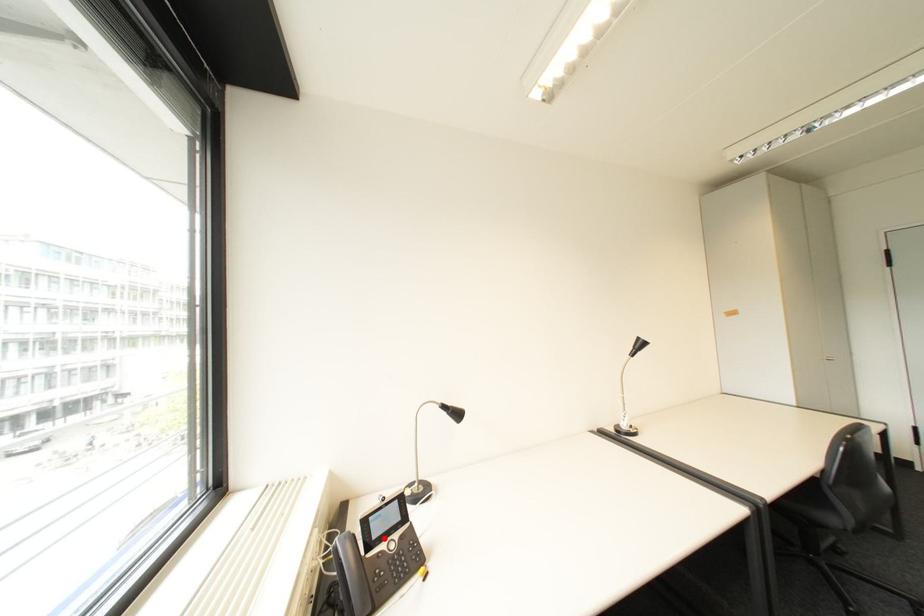
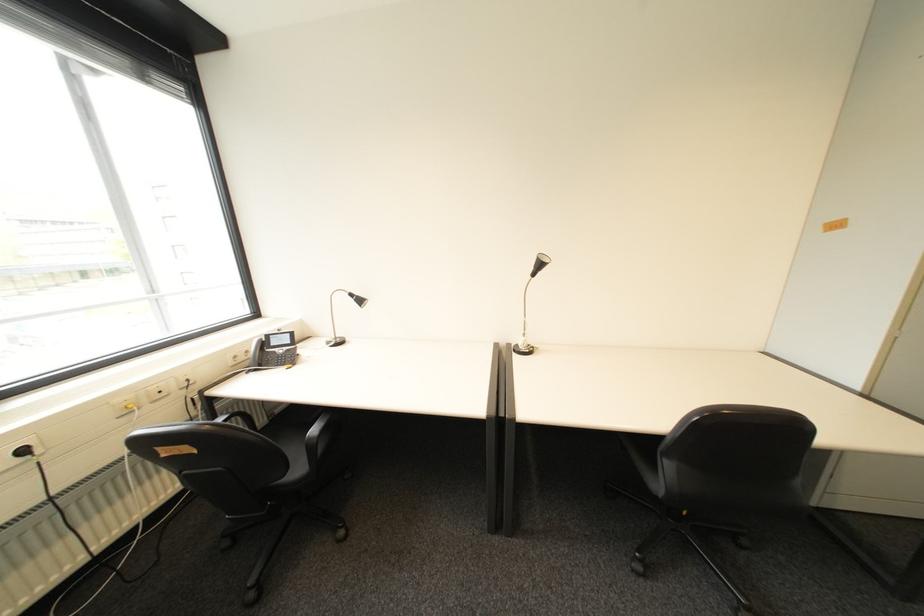
Question: I am providing you with two images of the same scene from different viewpoints. In image1, a red point is highlighted. Considering the same 3D point in image2, which of the following is correct?

Choices:
 (A) It is closer
 (B) It is farther

Answer: (A)